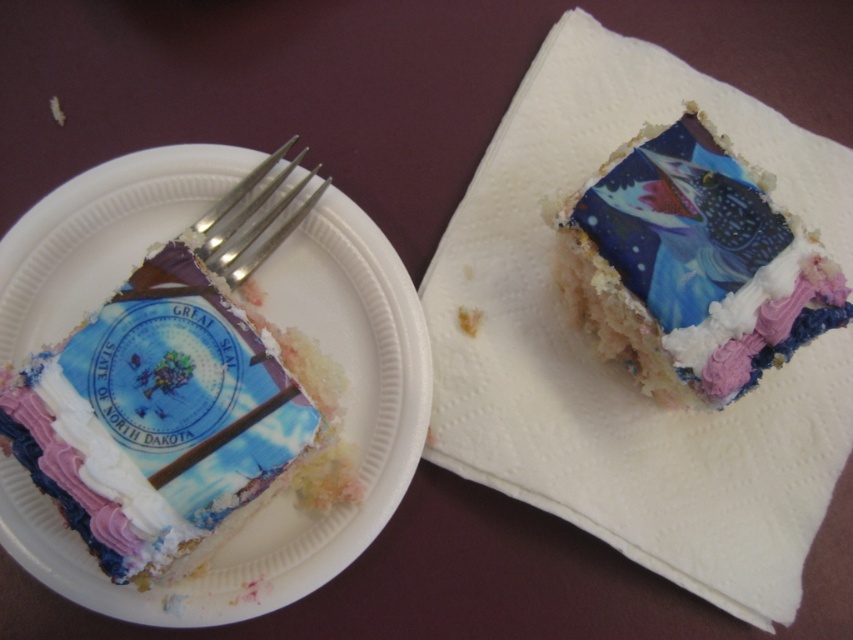
You are a guest at a party and want to choose the cake slice that is bigger. Which one should you pick between the shiny blue cake at upper right and the silver metallic fork at upper left?

The shiny blue cake at upper right is larger in size than the silver metallic fork at upper left, so you should pick the shiny blue cake at upper right.

Consider the image. You are a guest at a birthday party and want to eat the matte white cake at left. There is a silver metallic fork at upper left. Can you reach the cake without moving the fork?

The matte white cake at left is in front of the silver metallic fork at upper left, so the fork is blocking access to the cake. You would need to move the fork to reach the cake.